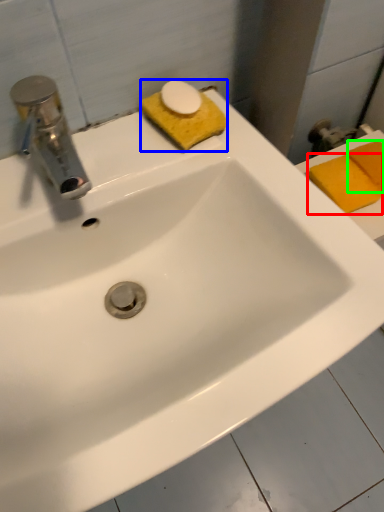
Question: Considering the real-world distances, which object is closest to soap (highlighted by a red box)? soap (highlighted by a blue box) or soap (highlighted by a green box).

Choices:
 (A) soap
 (B) soap

Answer: (B)